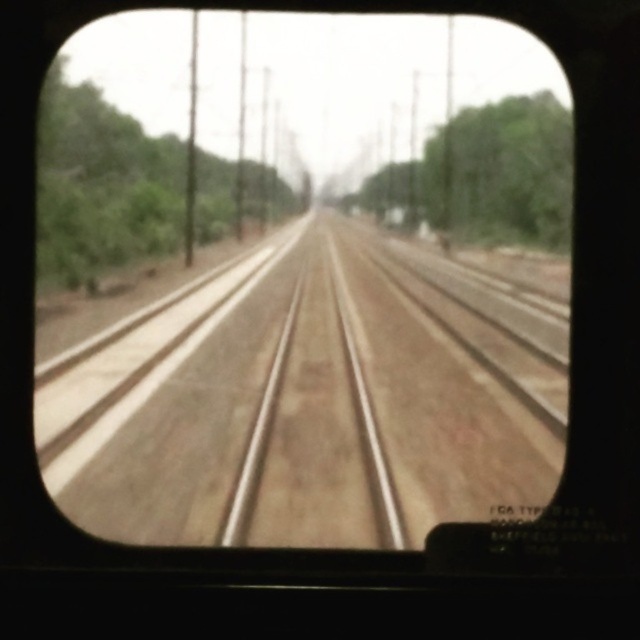
You are a passenger on a train and want to know if you can safely place your 12 inch wide backpack between the brown dirt track at center and the green leafy tree at left without it overlapping either. Based on the scene, can you do this?

The brown dirt track at center and green leafy tree at left are 13.87 inches apart. Since your backpack is 12 inches wide, it would fit between them with about 1.87 inches of space on each side, so yes, you can safely place it there.

You are a passenger on a train and notice the brown dirt track at center and the green leafy tree at center through the window. Which object is closer to the bottom edge of the window?

The brown dirt track at center is positioned under the green leafy tree at center, so the brown dirt track at center is closer to the bottom edge of the window.

You are standing on the train tracks and see two points marked on the ground at coordinates point (260, 484). How far apart are they?

The two points marked on the ground at coordinates point (260, 484) are 6.66 feet apart.